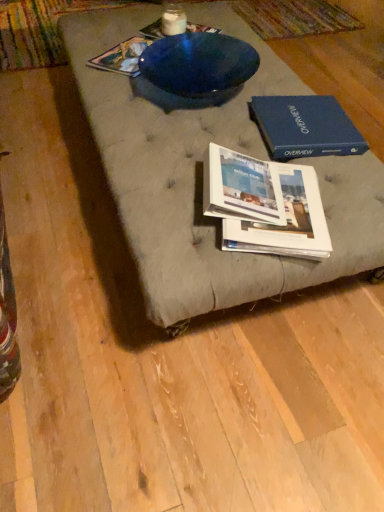
At what (x,y) coordinates should I click in order to perform the action: click on free space above blue glossy bowl at upper center, the 2th book in the top-to-bottom sequence (from a real-world perspective). Please return your answer as a coordinate pair (x, y). This screenshot has height=512, width=384. Looking at the image, I should click on (139, 49).